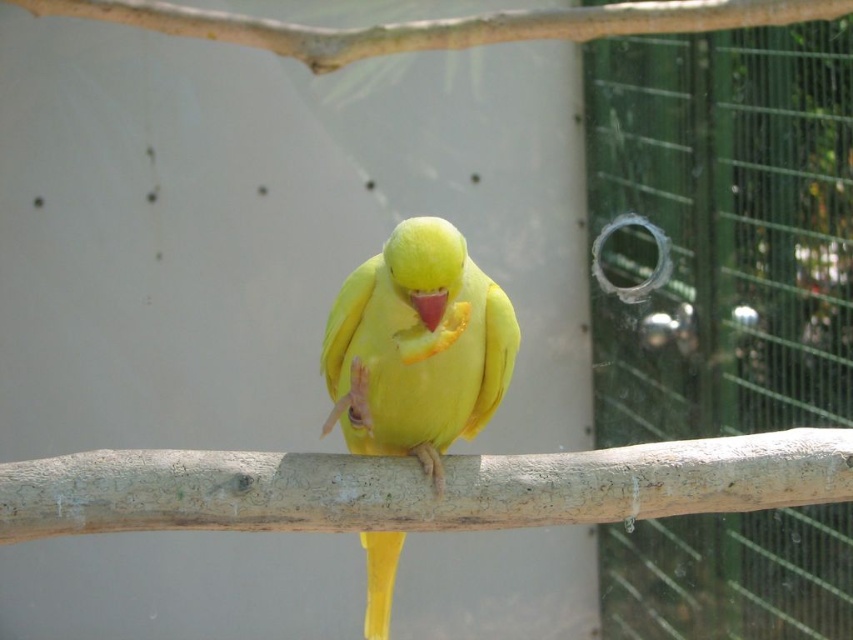
Question: Which point is closer to the camera?

Choices:
 (A) smooth wood branch at center
 (B) yellow matte parrot at center
 (C) smooth wood branch at upper center

Answer: (A)

Question: Which of the following is the closest to the observer?

Choices:
 (A) (344, 433)
 (B) (616, 465)
 (C) (310, 40)

Answer: (B)

Question: From the image, what is the correct spatial relationship of smooth wood branch at center in relation to yellow matte parrot at center?

Choices:
 (A) right
 (B) left

Answer: (A)

Question: Considering the real-world distances, which object is closest to the yellow matte parrot at center?

Choices:
 (A) smooth wood branch at upper center
 (B) smooth wood branch at center

Answer: (B)

Question: Is yellow matte parrot at center further to the viewer compared to smooth wood branch at upper center?

Choices:
 (A) no
 (B) yes

Answer: (A)

Question: Does smooth wood branch at center appear on the left side of smooth wood branch at upper center?

Choices:
 (A) no
 (B) yes

Answer: (A)